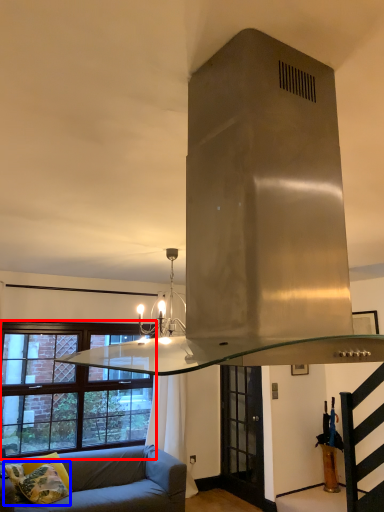
Question: Among these objects, which one is farthest to the camera, window (highlighted by a red box) or pillow (highlighted by a blue box)?

Choices:
 (A) window
 (B) pillow

Answer: (A)